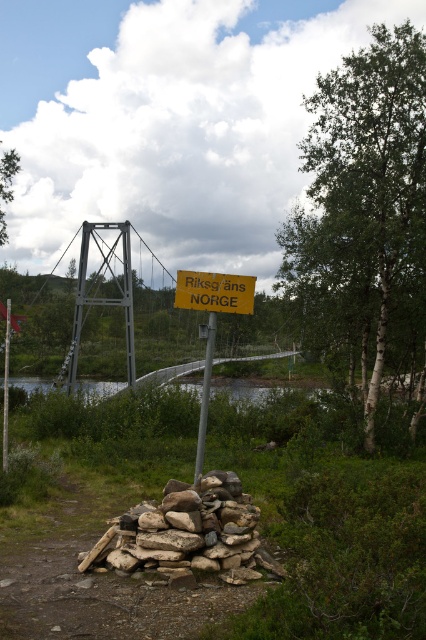
You are a hiker approaching the suspension bridge and see the yellow paper sign at center and the silver metallic pole at center. Which object is closer to you as you approach the bridge?

The yellow paper sign at center is closer to you because it is in front of the silver metallic pole at center.

You are a hiker who just arrived at the border marked by the yellow paper sign at center and the silver metallic pole at center. You need to determine which object is taller to set up your tent. Which one is taller?

The yellow paper sign at center is much taller than the silver metallic pole at center, so the yellow paper sign at center is the taller object.